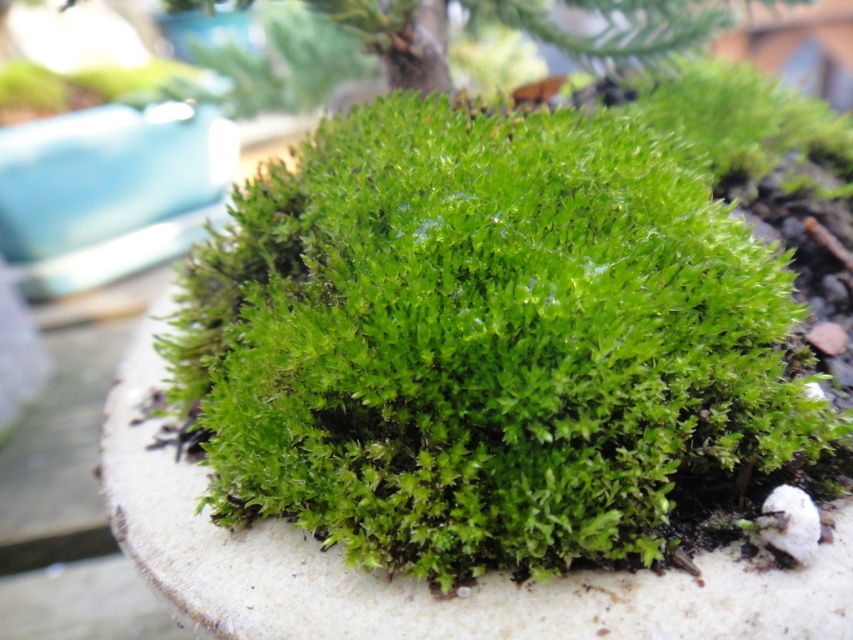
Based on the photo, between green fuzzy moss at center and green leafy tree at upper center, which one has less height?

Standing shorter between the two is green leafy tree at upper center.

Is green fuzzy moss at center taller than green leafy tree at upper center?

Yes.

Locate an element on the screen. This screenshot has height=640, width=853. green fuzzy moss at center is located at coordinates (485, 340).